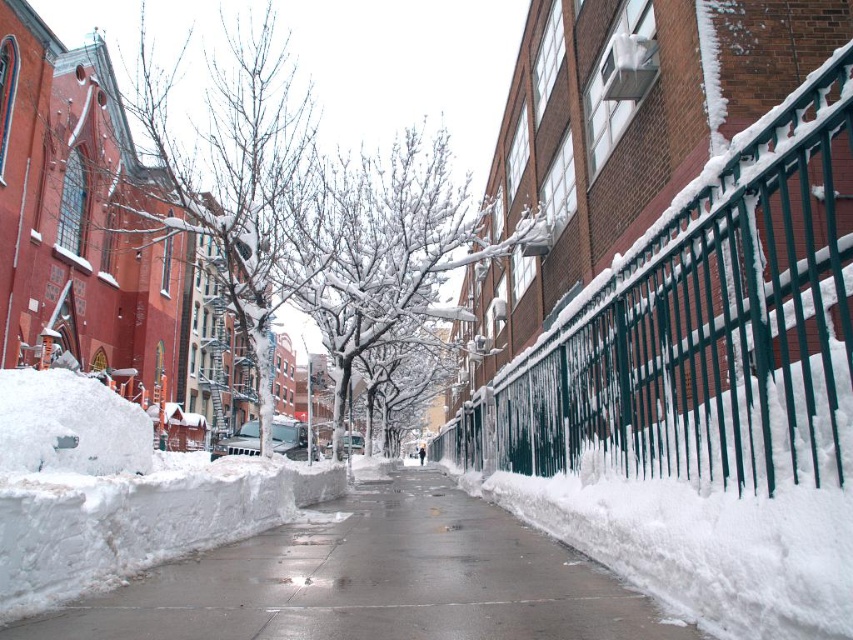
Question: Which object appears farthest from the camera in this image?

Choices:
 (A) snow-covered branches at left
 (B) green wrought iron fence at right
 (C) smooth concrete sidewalk at center

Answer: (A)

Question: Is green wrought iron fence at right to the left of snow-covered branches at center from the viewer's perspective?

Choices:
 (A) no
 (B) yes

Answer: (A)

Question: Which of these objects is positioned farthest from the snow-covered branches at left?

Choices:
 (A) green wrought iron fence at right
 (B) smooth concrete sidewalk at center
 (C) snow-covered branches at center

Answer: (B)

Question: Estimate the real-world distances between objects in this image. Which object is farther from the snow-covered branches at center?

Choices:
 (A) smooth concrete sidewalk at center
 (B) green wrought iron fence at right
 (C) snow-covered branches at left

Answer: (C)

Question: Does green wrought iron fence at right have a lesser width compared to snow-covered branches at center?

Choices:
 (A) yes
 (B) no

Answer: (A)

Question: Does smooth concrete sidewalk at center lie behind snow-covered branches at left?

Choices:
 (A) no
 (B) yes

Answer: (A)